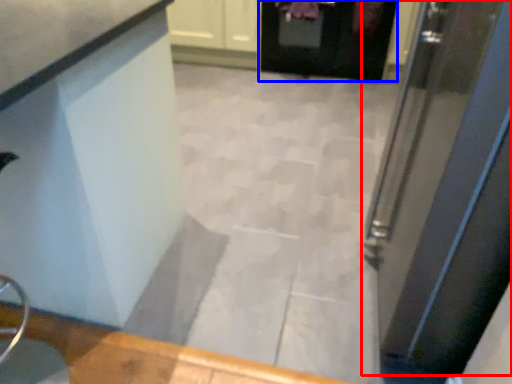
Question: Which object appears farthest to the camera in this image, door (highlighted by a red box) or door (highlighted by a blue box)?

Choices:
 (A) door
 (B) door

Answer: (B)